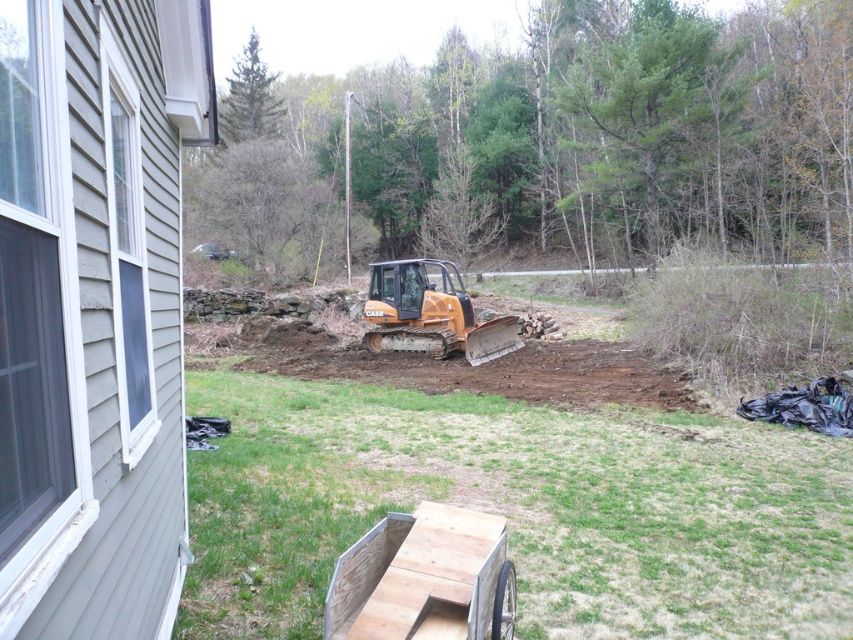
Question: Does orange compact tractor at center come in front of orange rubber plow at center?

Choices:
 (A) no
 (B) yes

Answer: (B)

Question: Is orange compact tractor at center smaller than orange rubber plow at center?

Choices:
 (A) yes
 (B) no

Answer: (B)

Question: Where is orange compact tractor at center located in relation to orange rubber plow at center in the image?

Choices:
 (A) left
 (B) right

Answer: (A)

Question: Which point is farther from the camera taking this photo?

Choices:
 (A) (473, 344)
 (B) (759, 461)

Answer: (A)